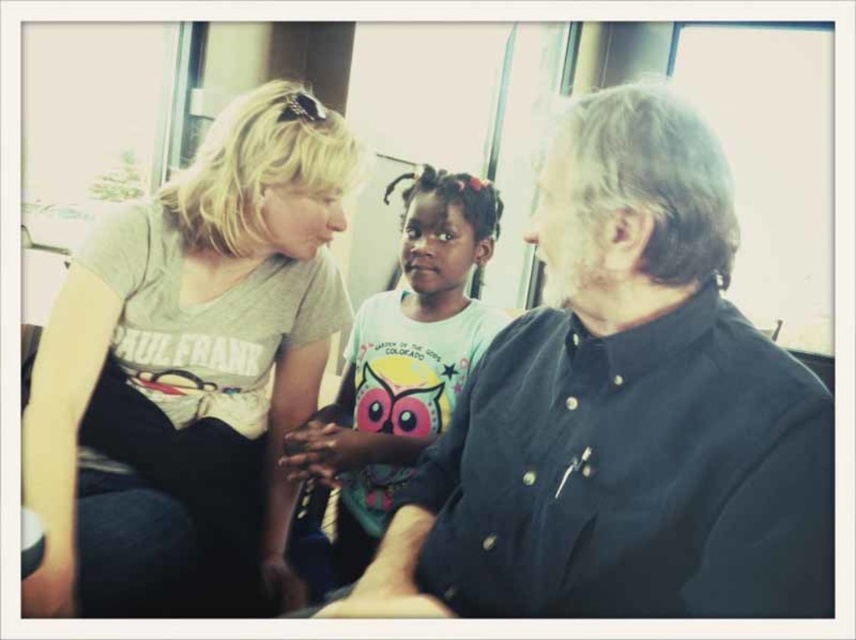
Does dark blue button-up shirt at center come behind white cotton shirt at center?

No, it is not.

Is dark blue button-up shirt at center to the left of white cotton shirt at center from the viewer's perspective?

In fact, dark blue button-up shirt at center is to the right of white cotton shirt at center.

Which is behind, point (694, 310) or point (343, 385)?

Positioned behind is point (343, 385).

Image resolution: width=856 pixels, height=640 pixels. I want to click on dark blue button-up shirt at center, so click(623, 412).

Does point (652, 97) lie behind point (217, 154)?

No, (652, 97) is closer to viewer.

Between dark blue button-up shirt at center and gray cotton t-shirt at upper left, which one appears on the right side from the viewer's perspective?

Positioned to the right is dark blue button-up shirt at center.

Find the location of a particular element. This screenshot has height=640, width=856. dark blue button-up shirt at center is located at coordinates (623, 412).

At what (x,y) coordinates should I click in order to perform the action: click on dark blue button-up shirt at center. Please return your answer as a coordinate pair (x, y). Looking at the image, I should click on (623, 412).

Does gray cotton t-shirt at upper left appear over white cotton shirt at center?

Yes, gray cotton t-shirt at upper left is above white cotton shirt at center.

Does point (27, 404) come closer to viewer compared to point (440, 236)?

Yes, point (27, 404) is in front of point (440, 236).

Describe the element at coordinates (189, 372) in the screenshot. I see `gray cotton t-shirt at upper left` at that location.

Find the location of `gray cotton t-shirt at upper left`. gray cotton t-shirt at upper left is located at coordinates (189, 372).